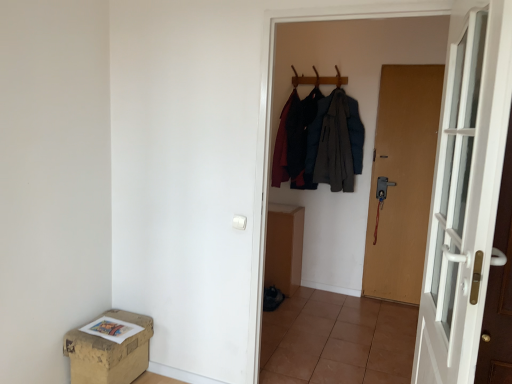
At what (x,y) coordinates should I click in order to perform the action: click on brown tile at center. Please return your answer as a coordinate pair (x, y). Looking at the image, I should click on (337, 340).

This screenshot has height=384, width=512. Find the location of `white glass door at right, which is the first door from front to back`. white glass door at right, which is the first door from front to back is located at coordinates (465, 194).

The width and height of the screenshot is (512, 384). What do you see at coordinates (319, 79) in the screenshot?
I see `wooden coat hanger at upper center` at bounding box center [319, 79].

Locate an element on the screen. dark gray wool coat at center is located at coordinates (339, 142).

From the image's perspective, which is above, brown tile at center or wooden coat hanger at upper center?

wooden coat hanger at upper center is shown above in the image.

Considering the positions of objects brown tile at center and wooden coat hanger at upper center in the image provided, who is in front, brown tile at center or wooden coat hanger at upper center?

brown tile at center is in front.

Would you say brown tile at center contains wooden coat hanger at upper center?

That's incorrect, wooden coat hanger at upper center is not inside brown tile at center.

Is white glass door at right, which ranks as the second door in right-to-left order, next to dark gray wool coat at center and touching it?

white glass door at right, which ranks as the second door in right-to-left order, and dark gray wool coat at center are not in contact.

From the image's perspective, is white glass door at right, which is the first door from front to back, positioned above or below dark gray wool coat at center?

white glass door at right, which is the first door from front to back, is situated lower than dark gray wool coat at center in the image.

From a real-world perspective, is white glass door at right, which is the first door from front to back, beneath dark gray wool coat at center?

Yes, from a real-world perspective, white glass door at right, which is the first door from front to back, is below dark gray wool coat at center.

Does point (470, 52) come behind point (358, 135)?

No, (470, 52) is in front of (358, 135).

Which is in front, point (490, 110) or point (381, 313)?

Positioned in front is point (490, 110).

Who is smaller, white glass door at right, placed as the second door when sorted from back to front, or brown tile at center?

With smaller size is brown tile at center.

Is white glass door at right, which is the first door from front to back, far from brown tile at center?

Yes.

Is brown cardboard box at lower left touching brown tile at center?

brown cardboard box at lower left and brown tile at center are clearly separated.

Would you say brown cardboard box at lower left is to the left or to the right of brown tile at center in the picture?

Based on their positions, brown cardboard box at lower left is located to the left of brown tile at center.

From the image's perspective, which one is positioned lower, brown cardboard box at lower left or brown tile at center?

brown tile at center, from the image's perspective.

From a real-world perspective, between brown cardboard box at lower left and brown tile at center, who is vertically lower?

brown tile at center, from a real-world perspective.

Is brown tile at center facing towards dark gray wool coat at center?

No.

From the image's perspective, is brown tile at center on top of dark gray wool coat at center?

No, from the image's perspective, brown tile at center is not above dark gray wool coat at center.

Is brown tile at center shorter than dark gray wool coat at center?

Indeed, brown tile at center has a lesser height compared to dark gray wool coat at center.

Is brown tile at center positioned before dark gray wool coat at center?

Yes, it is in front of dark gray wool coat at center.

From the image's perspective, does white glass door at right, which is the first door from front to back, appear higher than brown cardboard box at lower left?

Yes, from the image's perspective, white glass door at right, which is the first door from front to back, is on top of brown cardboard box at lower left.

Does white glass door at right, placed as the second door when sorted from back to front, appear on the left side of brown cardboard box at lower left?

In fact, white glass door at right, placed as the second door when sorted from back to front, is to the right of brown cardboard box at lower left.

In order to click on the 2nd door directly above the brown cardboard box at lower left (from a real-world perspective) in this screenshot , I will do `click(465, 194)`.

Locate an element on the screen. This screenshot has width=512, height=384. tile that is on the left side of wooden coat hanger at upper center is located at coordinates (337, 340).

Is wooden coat hanger at upper center positioned with its back to brown tile at center?

No.

Looking at this image, measure the distance between wooden coat hanger at upper center and brown tile at center.

wooden coat hanger at upper center is 6.94 feet away from brown tile at center.

Is wooden coat hanger at upper center further to camera compared to brown tile at center?

That is True.

In the image, there is a brown tile at center. Where is `hanger above it (from the image's perspective)`? hanger above it (from the image's perspective) is located at coordinates (319, 79).

The image size is (512, 384). I want to click on clothing that is above the white glass door at right, acting as the 1th door starting from the left (from a real-world perspective), so click(339, 142).

When comparing their distances from brown cardboard box at lower left, does wooden coat hanger at upper center or brown tile at center seem further?

The object further to brown cardboard box at lower left is wooden coat hanger at upper center.

Looking at the image, which one is located further to dark gray wool coat at center, wooden coat hanger at upper center or brown tile at center?

The object further to dark gray wool coat at center is brown tile at center.

From the image, which object appears to be farther from dark gray wool coat at center, wooden coat hanger at upper center or brown cardboard box at lower left?

brown cardboard box at lower left lies further to dark gray wool coat at center than the other object.

In the scene shown: Looking at the image, which one is located further to brown cardboard box at lower left, brown matte door at right, the second door viewed from the front, or dark gray wool coat at center?

brown matte door at right, the second door viewed from the front, is further to brown cardboard box at lower left.

When comparing their distances from wooden coat hanger at upper center, does white glass door at right, which ranks as the second door in right-to-left order, or brown cardboard box at lower left seem further?

brown cardboard box at lower left is positioned further to the anchor wooden coat hanger at upper center.

Looking at this image, from the image, which object appears to be nearer to white glass door at right, which ranks as the second door in right-to-left order, brown cardboard box at lower left or wooden coat hanger at upper center?

The object closer to white glass door at right, which ranks as the second door in right-to-left order, is brown cardboard box at lower left.

Which object lies nearer to the anchor point wooden coat hanger at upper center, dark gray wool coat at center or white glass door at right, acting as the 1th door starting from the left?

dark gray wool coat at center is positioned closer to the anchor wooden coat hanger at upper center.

Looking at the image, which one is located further to wooden coat hanger at upper center, dark gray wool coat at center or brown matte door at right, the second door viewed from the front?

brown matte door at right, the second door viewed from the front, is positioned further to the anchor wooden coat hanger at upper center.

Where is `tile between brown cardboard box at lower left and white glass door at right, acting as the 1th door starting from the left`? The image size is (512, 384). tile between brown cardboard box at lower left and white glass door at right, acting as the 1th door starting from the left is located at coordinates (337, 340).

Find the location of a particular element. This screenshot has height=384, width=512. tile located between white glass door at right, placed as the second door when sorted from back to front, and brown matte door at right, the second door viewed from the front, in the depth direction is located at coordinates (337, 340).

Find the location of a particular element. box located between white glass door at right, acting as the 1th door starting from the left, and wooden coat hanger at upper center in the depth direction is located at coordinates (109, 352).

Identify the location of door between white glass door at right, which is the first door from front to back, and wooden coat hanger at upper center in the front-back direction. This screenshot has height=384, width=512. (402, 181).